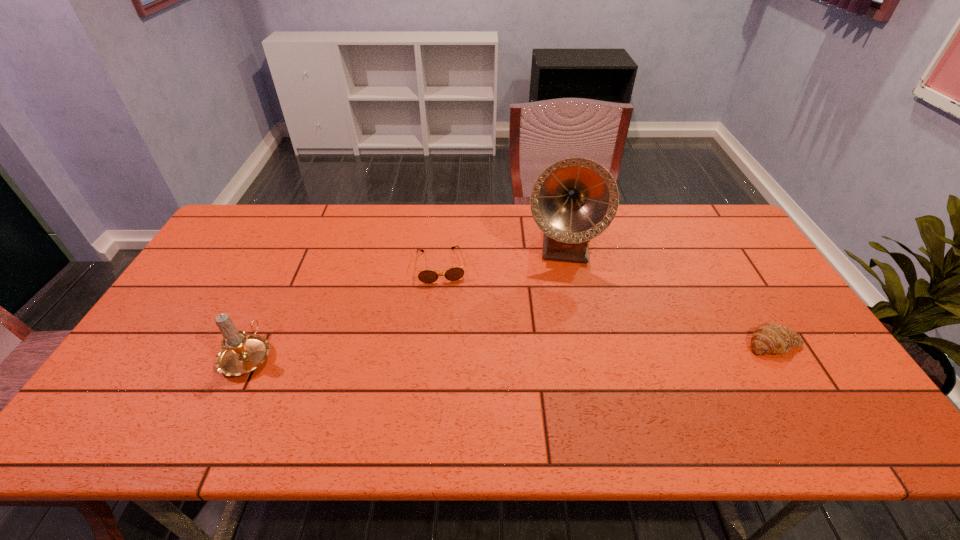
At what (x,y) coordinates should I click in order to perform the action: click on free space at the far right corner of the desktop. Please return your answer as a coordinate pair (x, y). Looking at the image, I should click on (730, 245).

Find the location of a particular element. empty space that is in between the tallest object and the leftmost object is located at coordinates (405, 301).

Identify the location of free area in between the leftmost object and the phonograph record. (405, 301).

Find the location of a particular element. unoccupied position between the candle and the sunglasses is located at coordinates (345, 310).

At what (x,y) coordinates should I click in order to perform the action: click on vacant point located between the leftmost object and the second object from right to left. Please return your answer as a coordinate pair (x, y). The width and height of the screenshot is (960, 540). Looking at the image, I should click on (405, 301).

The image size is (960, 540). In order to click on vacant space that is in between the rightmost object and the sunglasses in this screenshot , I will do (x=608, y=305).

Where is `unoccupied position between the leftmost object and the second object from left to right`? unoccupied position between the leftmost object and the second object from left to right is located at coordinates (345, 310).

Find the location of a particular element. vacant region between the rightmost object and the third object from right to left is located at coordinates (608, 305).

Locate an element on the screen. unoccupied position between the rightmost object and the second tallest object is located at coordinates (511, 349).

Image resolution: width=960 pixels, height=540 pixels. Find the location of `free spot between the sunglasses and the rightmost object`. free spot between the sunglasses and the rightmost object is located at coordinates (608, 305).